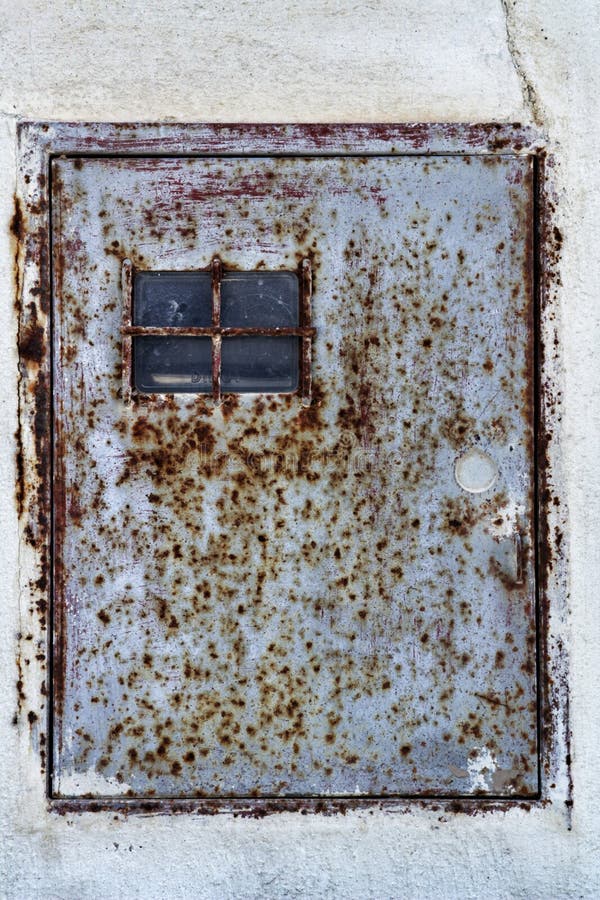
Locate an element on the screen. The width and height of the screenshot is (600, 900). rust on door is located at coordinates (263, 720), (238, 636), (141, 641), (180, 617).